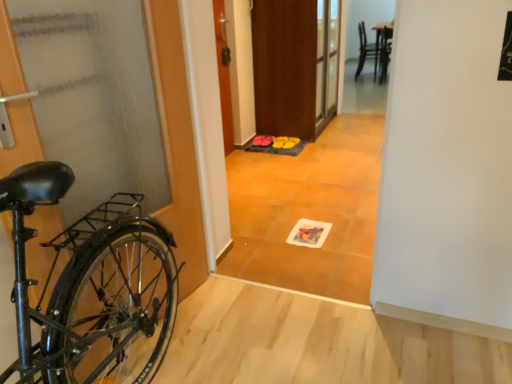
Question: Is matte orange floor mat at center facing away from wooden door at center, the first door when ordered from top to bottom?

Choices:
 (A) yes
 (B) no

Answer: (B)

Question: From the image's perspective, is matte orange floor mat at center located beneath wooden door at center, arranged as the second door when viewed from the front?

Choices:
 (A) yes
 (B) no

Answer: (A)

Question: Is matte orange floor mat at center far from wooden door at center, which is the 2th door from bottom to top?

Choices:
 (A) no
 (B) yes

Answer: (A)

Question: Can you confirm if matte orange floor mat at center is shorter than wooden door at center, arranged as the second door when viewed from the front?

Choices:
 (A) no
 (B) yes

Answer: (A)

Question: Considering the relative positions of matte orange floor mat at center and wooden door at center, arranged as the second door when viewed from the front, in the image provided, is matte orange floor mat at center to the left of wooden door at center, arranged as the second door when viewed from the front, from the viewer's perspective?

Choices:
 (A) no
 (B) yes

Answer: (A)

Question: From a real-world perspective, is matte orange floor mat at center above or below matte gray door at left, which is the 1th door in front-to-back order?

Choices:
 (A) below
 (B) above

Answer: (B)

Question: Looking at their shapes, would you say matte orange floor mat at center is wider or thinner than matte gray door at left, which is the 1th door in front-to-back order?

Choices:
 (A) thin
 (B) wide

Answer: (A)

Question: Is point (273, 231) closer or farther from the camera than point (160, 117)?

Choices:
 (A) closer
 (B) farther

Answer: (B)

Question: In terms of height, does matte orange floor mat at center look taller or shorter compared to matte gray door at left, which is the 1th door in front-to-back order?

Choices:
 (A) tall
 (B) short

Answer: (A)

Question: In the image, is wooden door at center, arranged as the second door when viewed from the front, positioned in front of or behind brown wooden screen door at center?

Choices:
 (A) front
 (B) behind

Answer: (A)

Question: Is wooden door at center, which is the 1th door from back to front, spatially inside brown wooden screen door at center, or outside of it?

Choices:
 (A) outside
 (B) inside

Answer: (A)

Question: From a real-world perspective, is wooden door at center, which is the 1th door from back to front, positioned above or below brown wooden screen door at center?

Choices:
 (A) above
 (B) below

Answer: (A)

Question: From the image's perspective, relative to brown wooden screen door at center, is wooden door at center, arranged as the second door when viewed from the front, above or below?

Choices:
 (A) below
 (B) above

Answer: (A)

Question: From the image's perspective, relative to matte pink shoes at center, is wooden door at center, the first door when ordered from top to bottom, above or below?

Choices:
 (A) above
 (B) below

Answer: (A)

Question: Based on their positions, is wooden door at center, the first door when ordered from top to bottom, located to the left or right of matte pink shoes at center?

Choices:
 (A) left
 (B) right

Answer: (A)